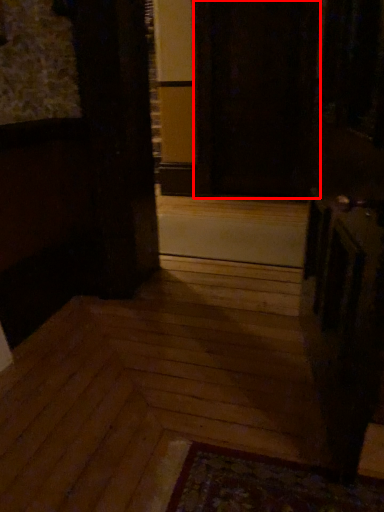
Question: Considering the relative positions of screen door (annotated by the red box) and stairwell in the image provided, where is screen door (annotated by the red box) located with respect to the staircase?

Choices:
 (A) right
 (B) left

Answer: (A)